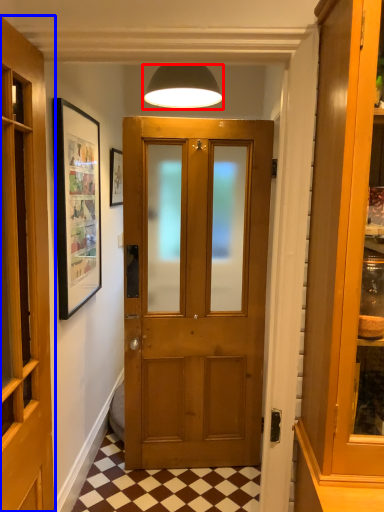
Question: Which object is closer to the camera taking this photo, lamp (highlighted by a red box) or door (highlighted by a blue box)?

Choices:
 (A) lamp
 (B) door

Answer: (B)